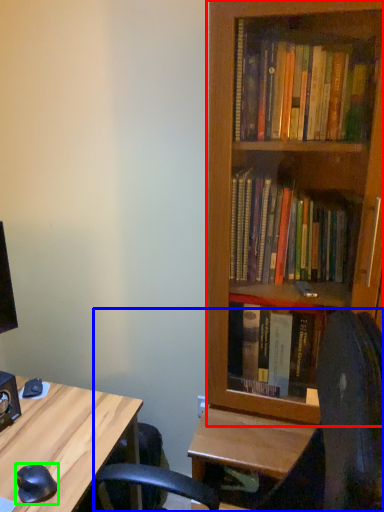
Question: Based on their relative distances, which object is nearer to bookcase (highlighted by a red box)? Choose from computer chair (highlighted by a blue box) and mouse (highlighted by a green box).

Choices:
 (A) computer chair
 (B) mouse

Answer: (A)